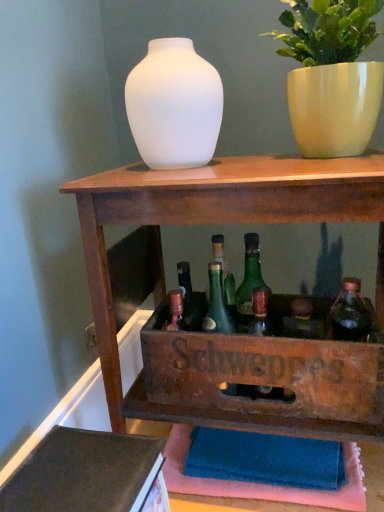
I want to click on free region on the left part of white glossy pot at upper right, so click(226, 169).